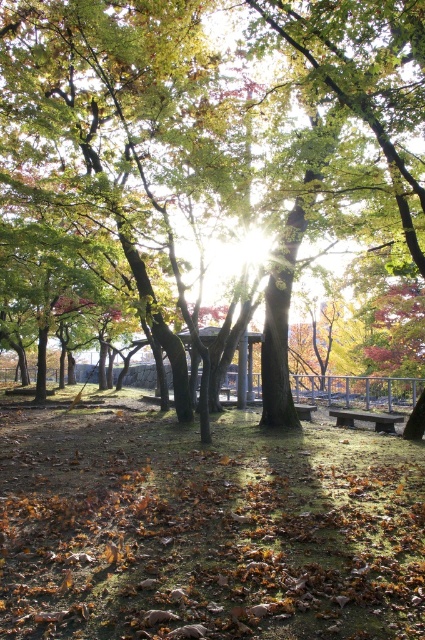
Which is more to the right, rustic wood bench at center or wooden park bench at center?

From the viewer's perspective, rustic wood bench at center appears more on the right side.

Who is more distant from viewer, (380,429) or (308,413)?

The point (308,413) is behind.

Which is behind, point (388, 428) or point (306, 413)?

The point (306, 413) is behind.

Locate an element on the screen. The height and width of the screenshot is (640, 425). rustic wood bench at center is located at coordinates (365, 419).